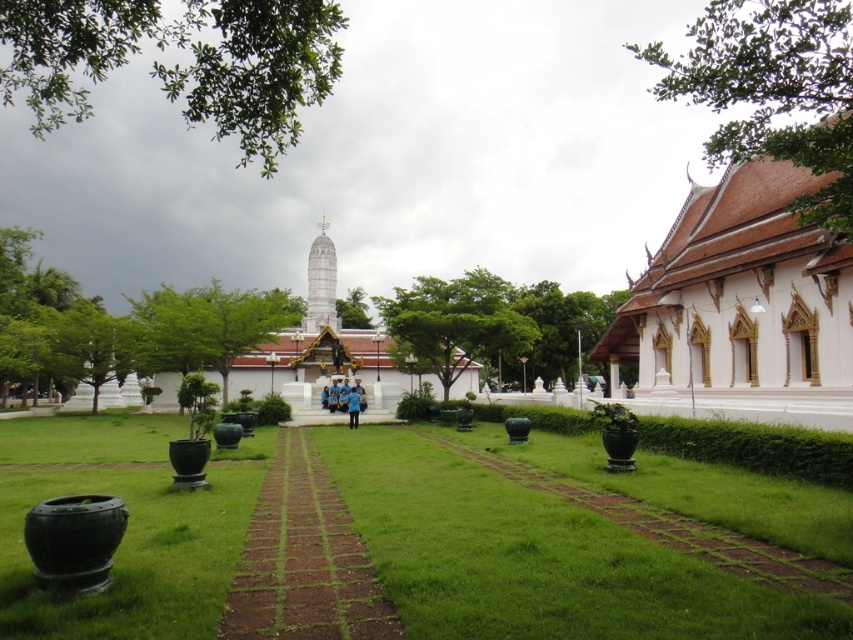
You are standing at the point marked as point (166, 525). You want to walk to the pagoda in the background. Is the path between the two large dark green ceramic pots on both sides of the brick pathway wide enough for a wheelchair with a 1.2 meter width?

The path between the two large dark green ceramic pots on both sides of the brick pathway is 19.38 meters wide, so yes, the wheelchair with a 1.2 meter width can easily pass through the path between the two large dark green ceramic pots on both sides of the brick pathway since it is wider than the wheelchair.